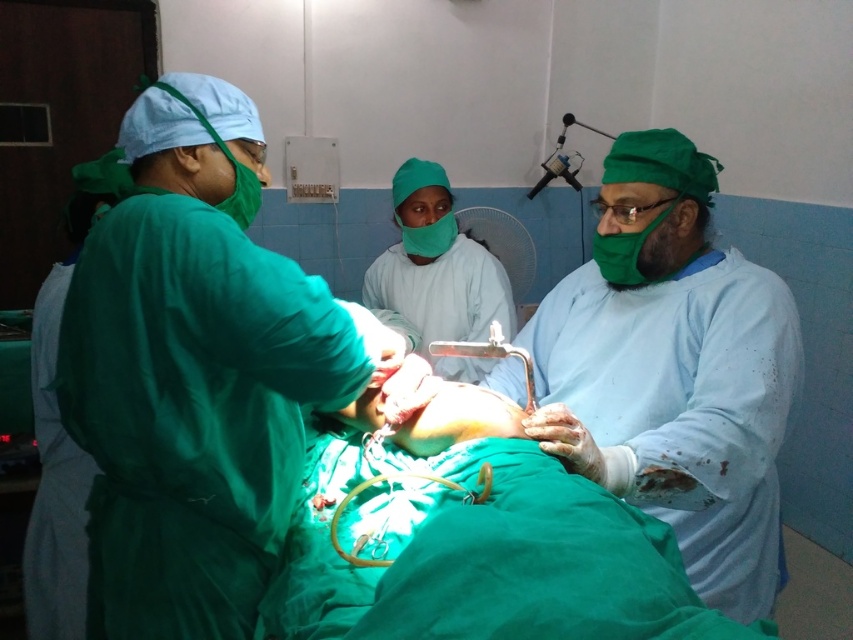
From the picture: Can you confirm if green matte surgical gown at center is shorter than metallic surgical light at center?

No.

Describe the element at coordinates (436, 266) in the screenshot. I see `green matte surgical gown at center` at that location.

Locate an element on the screen. The width and height of the screenshot is (853, 640). green matte surgical gown at center is located at coordinates 436,266.

What do you see at coordinates (672, 371) in the screenshot? I see `blue surgical gown at center` at bounding box center [672, 371].

Who is shorter, blue surgical gown at center or green surgical gown at center?

green surgical gown at center

Which is in front, point (785, 289) or point (653, 541)?

Point (653, 541)

Locate an element on the screen. Image resolution: width=853 pixels, height=640 pixels. blue surgical gown at center is located at coordinates (672, 371).

Can you confirm if green surgical gown at center is positioned below metallic silver scissors at center?

Yes.

You are a GUI agent. You are given a task and a screenshot of the screen. Output one action in this format:
    pyautogui.click(x=<x>, y=<y>)
    Task: Click on the green surgical gown at center
    The height and width of the screenshot is (640, 853).
    Given the screenshot: What is the action you would take?
    pyautogui.click(x=473, y=538)